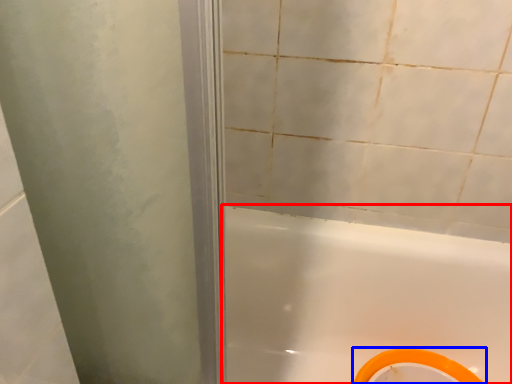
Question: Which object appears closest to the camera in this image, bathtub (highlighted by a red box) or bidet (highlighted by a blue box)?

Choices:
 (A) bathtub
 (B) bidet

Answer: (A)